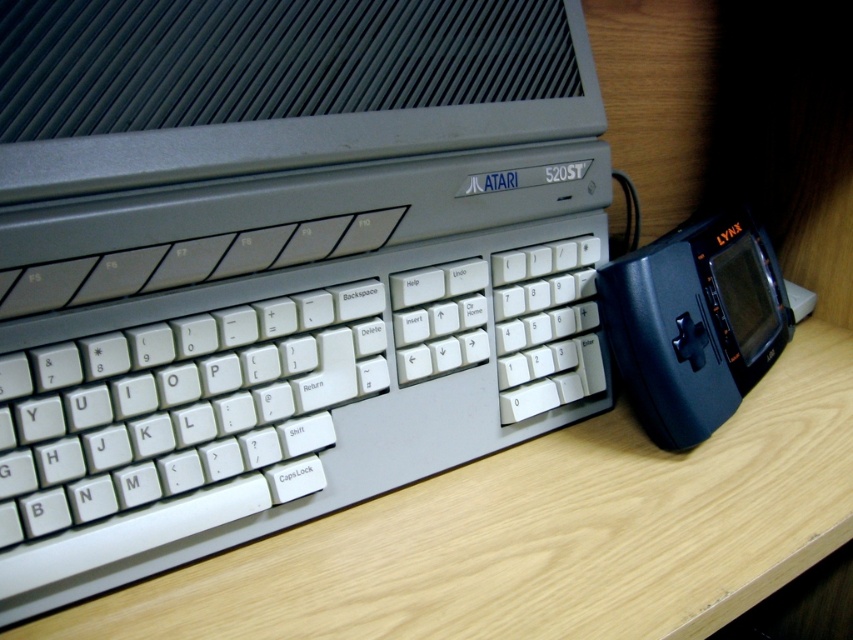
You are standing in front of the vintage computer setup. You see two points marked in the image. The first point is at coordinates point (74, 211) and the second point is at point (519, 552). Which point is closer to you?

Point (74, 211) is in front of point (519, 552), so it is closer to you.